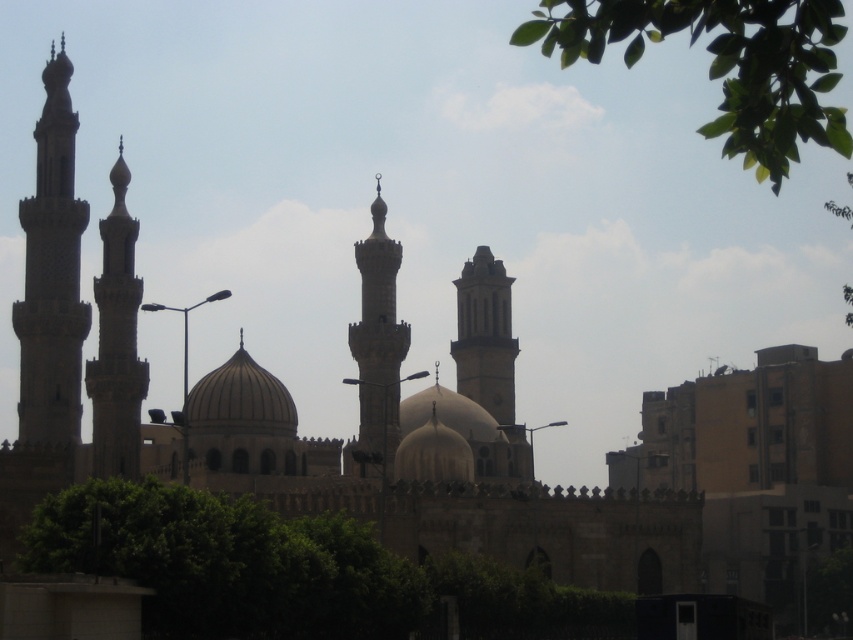
Can you confirm if gray stone minaret at left is bigger than stone minaret at left?

Actually, gray stone minaret at left might be smaller than stone minaret at left.

Can you confirm if gray stone minaret at left is positioned to the right of stone minaret at left?

No, gray stone minaret at left is not to the right of stone minaret at left.

At what (x,y) coordinates should I click in order to perform the action: click on gray stone minaret at left. Please return your answer as a coordinate pair (x, y). Looking at the image, I should click on (51, 275).

From the picture: Is smooth beige minaret at center further to camera compared to smooth beige dome at center?

No.

Is smooth beige minaret at center below smooth beige dome at center?

No, smooth beige minaret at center is not below smooth beige dome at center.

Identify the location of smooth beige minaret at center. (376, 344).

Is smooth beige minaret at center shorter than smooth stone minaret at center?

In fact, smooth beige minaret at center may be taller than smooth stone minaret at center.

Who is positioned more to the right, smooth beige minaret at center or smooth stone minaret at center?

Positioned to the right is smooth stone minaret at center.

Where is `smooth beige minaret at center`? This screenshot has height=640, width=853. smooth beige minaret at center is located at coordinates (376, 344).